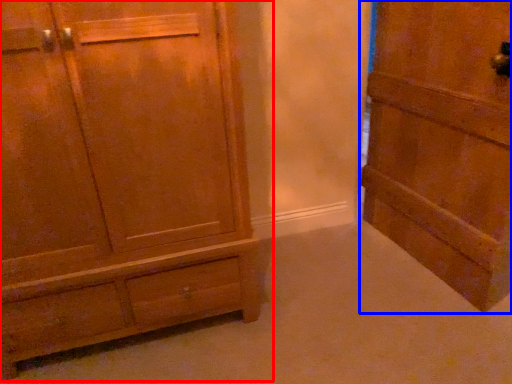
Question: Which object appears closest to the camera in this image, chest of drawers (highlighted by a red box) or door (highlighted by a blue box)?

Choices:
 (A) chest of drawers
 (B) door

Answer: (A)